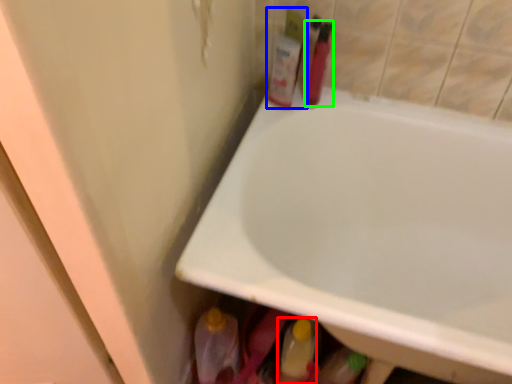
Question: Considering the real-world distances, which object is closest to mouthwash (highlighted by a red box)? toiletry (highlighted by a blue box) or toiletry (highlighted by a green box).

Choices:
 (A) toiletry
 (B) toiletry

Answer: (A)